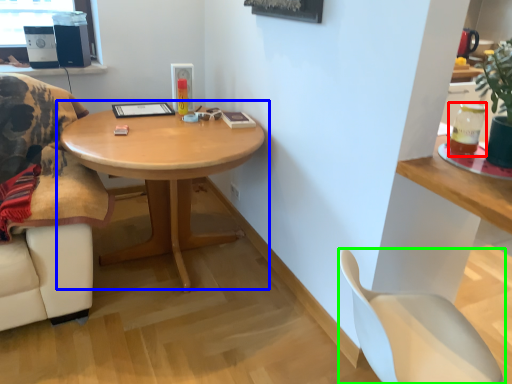
Question: Considering the real-world distances, which object is closest to beverage (highlighted by a red box)? coffee table (highlighted by a blue box) or chair (highlighted by a green box).

Choices:
 (A) coffee table
 (B) chair

Answer: (B)